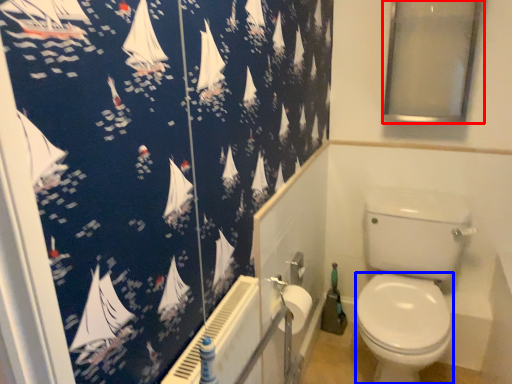
Question: Which point is further to the camera, window screen (highlighted by a red box) or bidet (highlighted by a blue box)?

Choices:
 (A) window screen
 (B) bidet

Answer: (B)